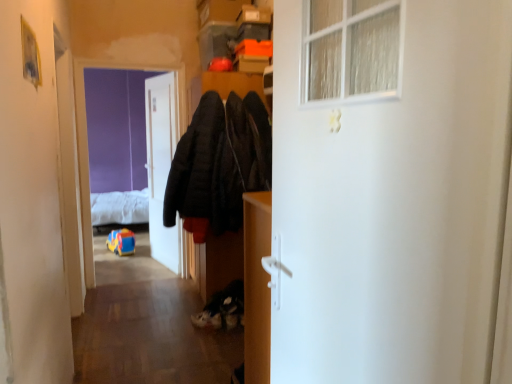
Question: Considering the relative sizes of white glossy door at center, which is the 1th door in left-to-right order, and purple matte screen door at upper left in the image provided, is white glossy door at center, which is the 1th door in left-to-right order, wider than purple matte screen door at upper left?

Choices:
 (A) yes
 (B) no

Answer: (B)

Question: Can purple matte screen door at upper left be found inside white glossy door at center, the second door positioned from the right?

Choices:
 (A) no
 (B) yes

Answer: (A)

Question: Could you tell me if white glossy door at center, the second door positioned from the right, is turned towards purple matte screen door at upper left?

Choices:
 (A) yes
 (B) no

Answer: (A)

Question: From the image's perspective, is white glossy door at center, which ranks as the 1th door in back-to-front order, on purple matte screen door at upper left?

Choices:
 (A) no
 (B) yes

Answer: (B)

Question: Is the depth of white glossy door at center, which is the 1th door in left-to-right order, greater than that of purple matte screen door at upper left?

Choices:
 (A) yes
 (B) no

Answer: (A)

Question: Is white glossy door at center, the second door positioned from the right, to the right of purple matte screen door at upper left from the viewer's perspective?

Choices:
 (A) yes
 (B) no

Answer: (A)

Question: Is white fluffy bed at upper left closer to the viewer compared to white glossy door at center, which ranks as the second door in front-to-back order?

Choices:
 (A) yes
 (B) no

Answer: (B)

Question: Considering the relative sizes of white fluffy bed at upper left and white glossy door at center, which ranks as the 1th door in back-to-front order, in the image provided, is white fluffy bed at upper left bigger than white glossy door at center, which ranks as the 1th door in back-to-front order,?

Choices:
 (A) no
 (B) yes

Answer: (B)

Question: Could you tell me if white fluffy bed at upper left is turned towards white glossy door at center, which ranks as the second door in front-to-back order?

Choices:
 (A) yes
 (B) no

Answer: (B)

Question: Does white fluffy bed at upper left appear on the left side of white glossy door at center, which ranks as the second door in front-to-back order?

Choices:
 (A) yes
 (B) no

Answer: (A)

Question: Is white fluffy bed at upper left oriented away from white glossy door at center, which is the 1th door in left-to-right order?

Choices:
 (A) no
 (B) yes

Answer: (A)

Question: Is white fluffy bed at upper left not near white glossy door at center, which is the 1th door in left-to-right order?

Choices:
 (A) yes
 (B) no

Answer: (B)

Question: Is white fluffy bed at upper left shorter than matte wood cabinet at center?

Choices:
 (A) no
 (B) yes

Answer: (B)